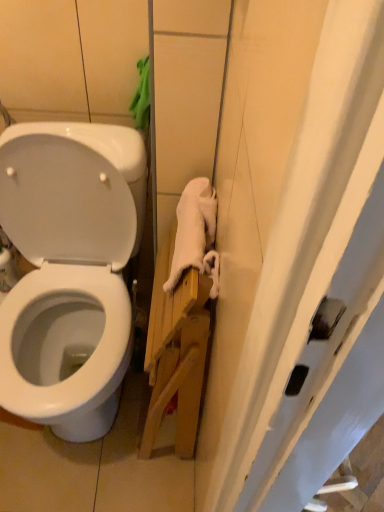
Question: Can you confirm if white soft towel at right is positioned to the left of white glossy toilet at upper left?

Choices:
 (A) no
 (B) yes

Answer: (A)

Question: Does white soft towel at right have a larger size compared to white glossy toilet at upper left?

Choices:
 (A) no
 (B) yes

Answer: (A)

Question: From the image's perspective, does white soft towel at right appear lower than white glossy toilet at upper left?

Choices:
 (A) yes
 (B) no

Answer: (A)

Question: Could you tell me if white soft towel at right is turned towards white glossy toilet at upper left?

Choices:
 (A) yes
 (B) no

Answer: (B)

Question: Is white soft towel at right thinner than white glossy toilet at upper left?

Choices:
 (A) no
 (B) yes

Answer: (A)

Question: Considering the positions of white glossy toilet at upper left and white glossy toilet at left in the image, is white glossy toilet at upper left taller or shorter than white glossy toilet at left?

Choices:
 (A) tall
 (B) short

Answer: (A)

Question: Based on their sizes in the image, would you say white glossy toilet at upper left is bigger or smaller than white glossy toilet at left?

Choices:
 (A) big
 (B) small

Answer: (B)

Question: Considering their positions, is white glossy toilet at upper left located in front of or behind white glossy toilet at left?

Choices:
 (A) front
 (B) behind

Answer: (B)

Question: In the image, is white glossy toilet at upper left on the left side or the right side of white glossy toilet at left?

Choices:
 (A) left
 (B) right

Answer: (A)

Question: In the image, is white glossy toilet at left positioned in front of or behind white glossy toilet at upper left?

Choices:
 (A) front
 (B) behind

Answer: (A)

Question: Is white glossy toilet at left situated inside white glossy toilet at upper left or outside?

Choices:
 (A) inside
 (B) outside

Answer: (B)

Question: From their relative heights in the image, would you say white glossy toilet at left is taller or shorter than white glossy toilet at upper left?

Choices:
 (A) tall
 (B) short

Answer: (B)

Question: Considering the positions of white glossy toilet at left and white glossy toilet at upper left in the image, is white glossy toilet at left bigger or smaller than white glossy toilet at upper left?

Choices:
 (A) big
 (B) small

Answer: (A)

Question: From a real-world perspective, is white soft towel at right physically located above or below white glossy toilet at upper left?

Choices:
 (A) below
 (B) above

Answer: (B)

Question: Considering the positions of white soft towel at right and white glossy toilet at upper left in the image, is white soft towel at right wider or thinner than white glossy toilet at upper left?

Choices:
 (A) thin
 (B) wide

Answer: (B)